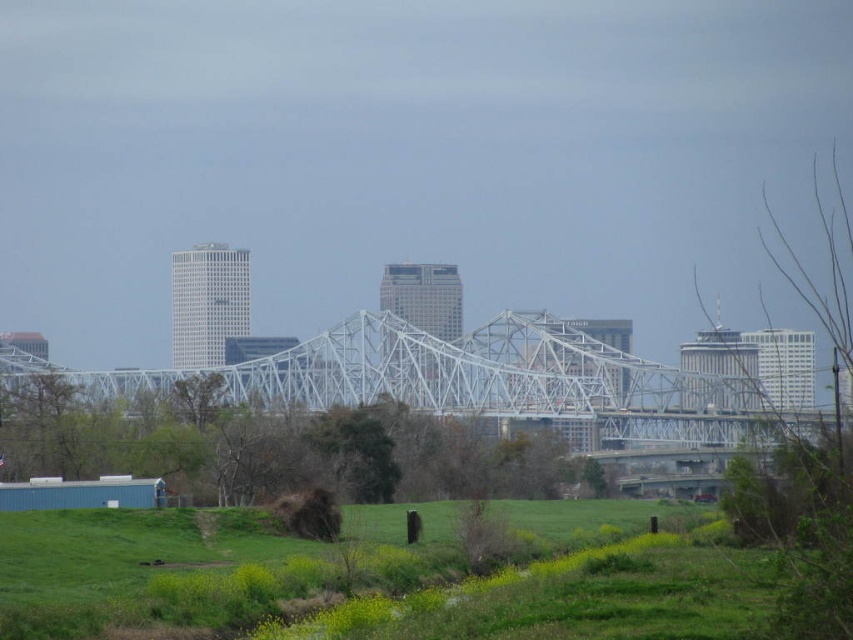
Does green leafy tree at center appear on the left side of bare branches at right?

Correct, you'll find green leafy tree at center to the left of bare branches at right.

Who is taller, green leafy tree at center or bare branches at right?

Standing taller between the two is bare branches at right.

Measure the distance between point (212, 448) and camera.

Point (212, 448) is 423.69 meters away from camera.

At what (x,y) coordinates should I click in order to perform the action: click on green leafy tree at center. Please return your answer as a coordinate pair (x, y). This screenshot has height=640, width=853. Looking at the image, I should click on (270, 445).

What do you see at coordinates (378, 580) in the screenshot? This screenshot has height=640, width=853. I see `green grassy field at lower center` at bounding box center [378, 580].

Does green grassy field at lower center have a greater width compared to bare branches at right?

Yes.

The image size is (853, 640). What do you see at coordinates (378, 580) in the screenshot?
I see `green grassy field at lower center` at bounding box center [378, 580].

This screenshot has width=853, height=640. Identify the location of green grassy field at lower center. (378, 580).

In the scene shown: Is white metallic bridge at center below bare branches at right?

Yes, white metallic bridge at center is below bare branches at right.

Is white metallic bridge at center positioned behind bare branches at right?

Yes, it is.

The image size is (853, 640). What do you see at coordinates (474, 381) in the screenshot?
I see `white metallic bridge at center` at bounding box center [474, 381].

At what (x,y) coordinates should I click in order to perform the action: click on white metallic bridge at center. Please return your answer as a coordinate pair (x, y). The image size is (853, 640). Looking at the image, I should click on (474, 381).